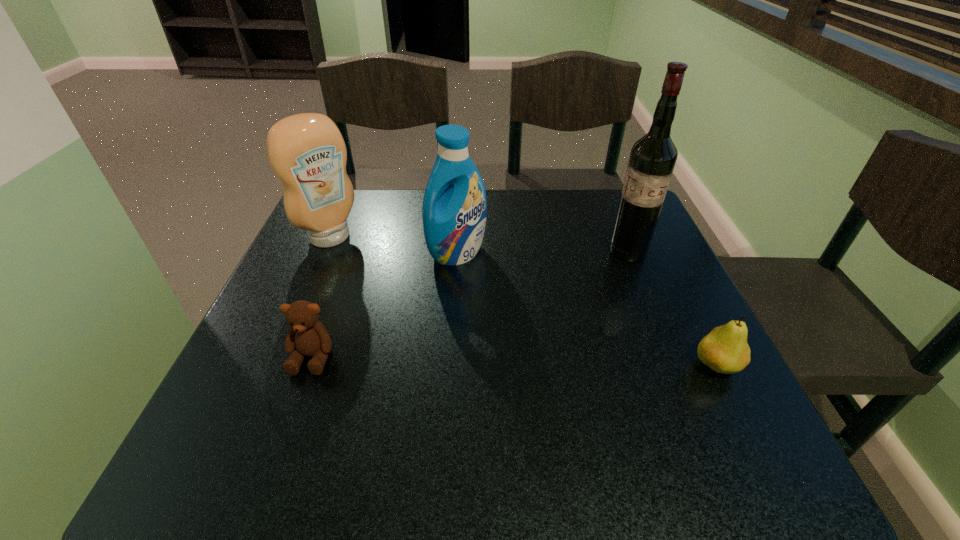
Image resolution: width=960 pixels, height=540 pixels. I want to click on pear located in the right edge section of the desktop, so click(725, 350).

I want to click on wine bottle situated at the right edge, so click(652, 159).

Find the location of `object located at the far left corner`. object located at the far left corner is located at coordinates (307, 153).

The width and height of the screenshot is (960, 540). Identify the location of object that is at the near right corner. (725, 350).

I want to click on vacant space at the far edge, so click(x=546, y=228).

At what (x,y) coordinates should I click in order to perform the action: click on vacant space at the near edge of the desktop. Please return your answer as a coordinate pair (x, y). This screenshot has height=540, width=960. Looking at the image, I should click on (373, 379).

In the image, there is a desktop. What are the coordinates of `blank space at the left edge` in the screenshot? It's located at (301, 296).

Locate an element on the screen. vacant area at the right edge of the desktop is located at coordinates (648, 370).

In the image, there is a desktop. Where is `blank space at the near left corner`? The height and width of the screenshot is (540, 960). blank space at the near left corner is located at coordinates (304, 415).

Locate an element on the screen. The height and width of the screenshot is (540, 960). vacant space at the far right corner is located at coordinates (615, 210).